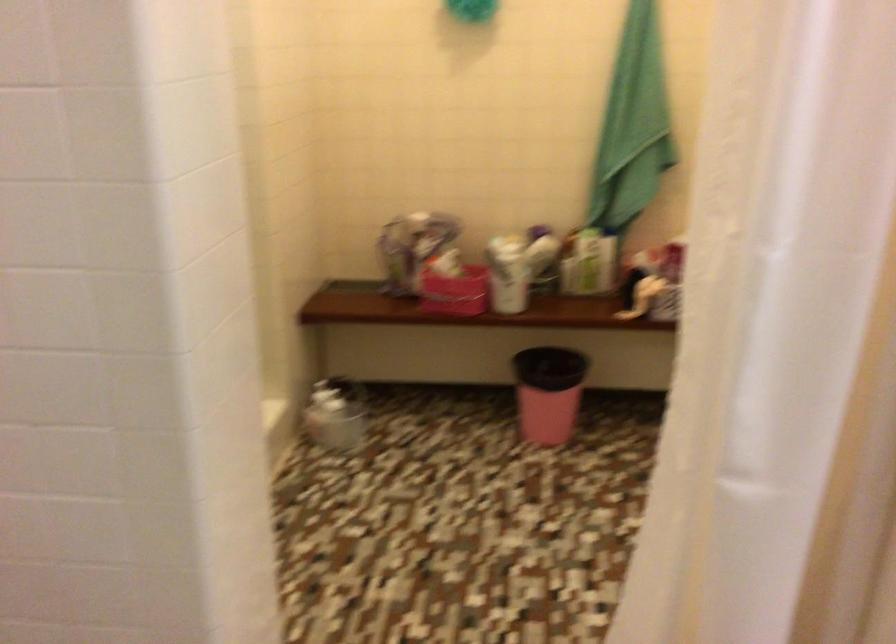
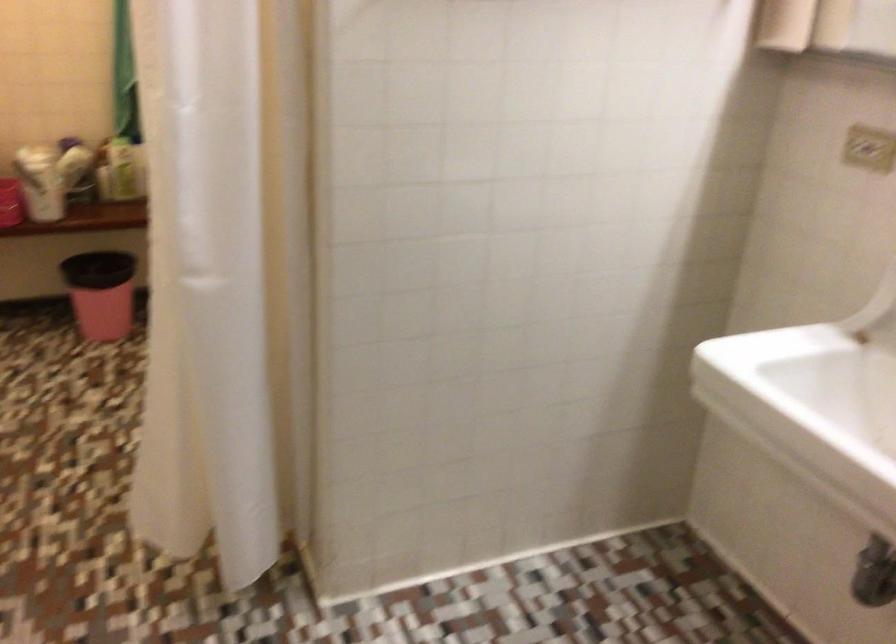
Locate, in the second image, the point that corresponds to pixel 552 397 in the first image.

(100, 292)